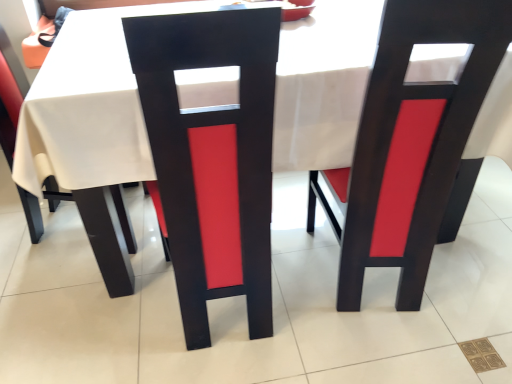
The image size is (512, 384). I want to click on vacant space that is to the left of matte black chair at center, which is the 3th chair from left to right, so [290, 280].